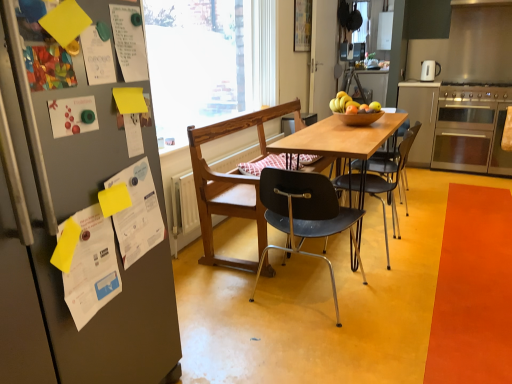
The height and width of the screenshot is (384, 512). What are the coordinates of `vacant space underneath black plastic chair at center, which appears as the 3th chair when viewed from the back (from a real-world perspective)` in the screenshot? It's located at (304, 290).